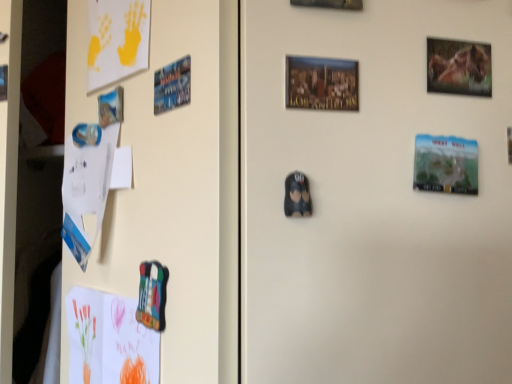
Question: Considering the relative positions of metallic blue magnet at upper left, the 3th print when ordered from front to back, and black matte plush toy at center, the 1th print ordered from the bottom, in the image provided, is metallic blue magnet at upper left, the 3th print when ordered from front to back, behind black matte plush toy at center, the 1th print ordered from the bottom,?

Choices:
 (A) no
 (B) yes

Answer: (B)

Question: Is metallic blue magnet at upper left, which ranks as the first print in back-to-front order, completely or partially outside of black matte plush toy at center, which is counted as the second print, starting from the left?

Choices:
 (A) yes
 (B) no

Answer: (A)

Question: Is metallic blue magnet at upper left, the 3th print when ordered from front to back, placed right next to black matte plush toy at center, marked as the third print in a top-to-bottom arrangement?

Choices:
 (A) no
 (B) yes

Answer: (A)

Question: Are metallic blue magnet at upper left, which ranks as the first print in back-to-front order, and black matte plush toy at center, the 1th print from the front, far apart?

Choices:
 (A) no
 (B) yes

Answer: (A)

Question: Can you confirm if metallic blue magnet at upper left, which ranks as the first print in back-to-front order, is shorter than black matte plush toy at center, the 3th print positioned from the back?

Choices:
 (A) yes
 (B) no

Answer: (B)

Question: Is black matte plush toy at center, the 3th print positioned from the back, inside the boundaries of green matte great wall of china print at right, which ranks as the second print in bottom-to-top order, or outside?

Choices:
 (A) inside
 (B) outside

Answer: (B)

Question: Considering the positions of point (292, 192) and point (416, 135), is point (292, 192) closer or farther from the camera than point (416, 135)?

Choices:
 (A) closer
 (B) farther

Answer: (A)

Question: In the image, is black matte plush toy at center, marked as the third print in a top-to-bottom arrangement, on the left side or the right side of green matte great wall of china print at right, which ranks as the second print in bottom-to-top order?

Choices:
 (A) right
 (B) left

Answer: (B)

Question: In terms of size, does black matte plush toy at center, the 1th print from the front, appear bigger or smaller than green matte great wall of china print at right, arranged as the second print when viewed from the top?

Choices:
 (A) small
 (B) big

Answer: (A)

Question: From a real-world perspective, relative to yellow matte paper at upper left, acting as the 1th postcard starting from the top, is colored paper postcard at lower left, placed as the 2th postcard when sorted from top to bottom, vertically above or below?

Choices:
 (A) above
 (B) below

Answer: (B)

Question: Considering their positions, is colored paper postcard at lower left, placed as the 2th postcard when sorted from top to bottom, located in front of or behind yellow matte paper at upper left, acting as the 1th postcard starting from the top?

Choices:
 (A) front
 (B) behind

Answer: (A)

Question: In terms of height, does colored paper postcard at lower left, placed as the 2th postcard when sorted from top to bottom, look taller or shorter compared to yellow matte paper at upper left, acting as the 1th postcard starting from the top?

Choices:
 (A) short
 (B) tall

Answer: (A)

Question: Considering the positions of colored paper postcard at lower left, placed as the 2th postcard when sorted from top to bottom, and yellow matte paper at upper left, acting as the 1th postcard starting from the top, in the image, is colored paper postcard at lower left, placed as the 2th postcard when sorted from top to bottom, bigger or smaller than yellow matte paper at upper left, acting as the 1th postcard starting from the top,?

Choices:
 (A) big
 (B) small

Answer: (A)

Question: Considering the positions of green matte great wall of china print at right, the first print viewed from the right, and metallic blue magnet at upper left, which appears as the third print when viewed from the right, in the image, is green matte great wall of china print at right, the first print viewed from the right, taller or shorter than metallic blue magnet at upper left, which appears as the third print when viewed from the right,?

Choices:
 (A) short
 (B) tall

Answer: (B)

Question: Looking at their shapes, would you say green matte great wall of china print at right, placed as the second print when sorted from back to front, is wider or thinner than metallic blue magnet at upper left, which ranks as the first print in back-to-front order?

Choices:
 (A) thin
 (B) wide

Answer: (B)